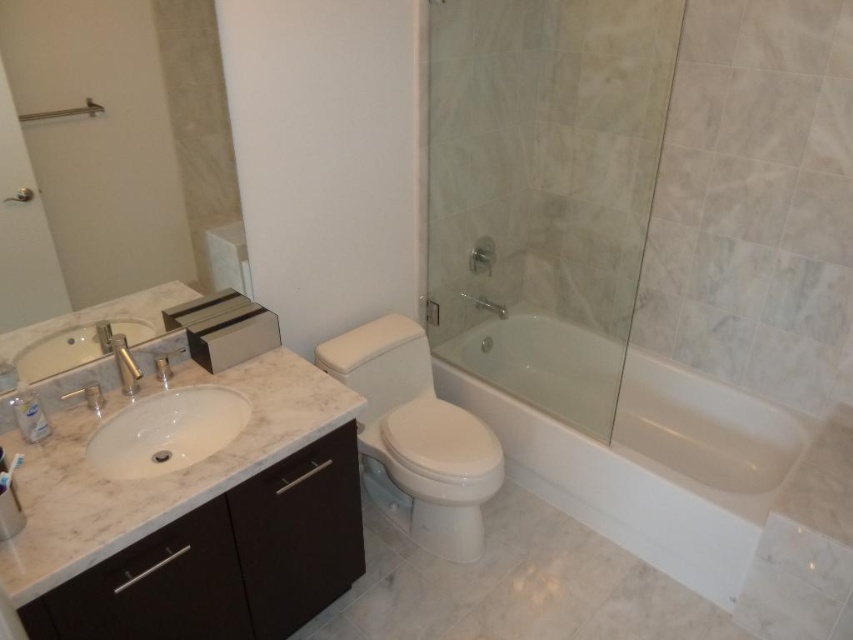
Question: Based on their relative distances, which object is farther from the marble sink at left?

Choices:
 (A) matte silver faucet at left
 (B) white glossy bathtub at center
 (C) matte white shower at upper center
 (D) white glossy toilet at center

Answer: (B)

Question: Which of the following is the closest to the observer?

Choices:
 (A) (33, 120)
 (B) (502, 422)
 (C) (355, 403)
 (D) (148, 412)

Answer: (A)

Question: Does white glossy bathtub at center appear under matte white shower at upper center?

Choices:
 (A) yes
 (B) no

Answer: (A)

Question: Can you confirm if white glossy toilet at center is positioned below matte white shower at upper center?

Choices:
 (A) no
 (B) yes

Answer: (B)

Question: Which object appears farthest from the camera in this image?

Choices:
 (A) white marble sink at lower left
 (B) matte silver faucet at left
 (C) white glossy toilet at center

Answer: (C)

Question: Can you confirm if white glossy bathtub at center is smaller than marble sink at left?

Choices:
 (A) yes
 (B) no

Answer: (B)